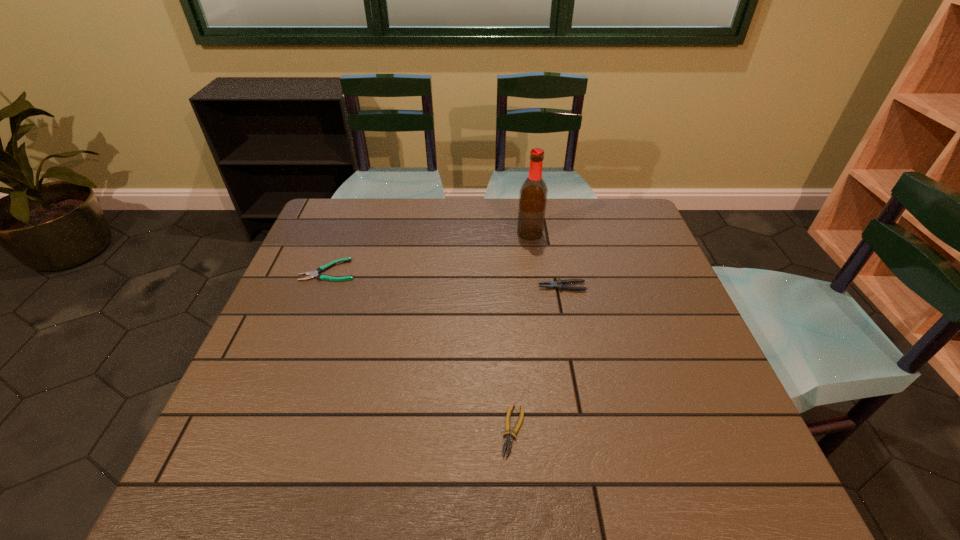
Where is `vacant area situated 0.050m at the gripping part of the tallest pliers`? Image resolution: width=960 pixels, height=540 pixels. vacant area situated 0.050m at the gripping part of the tallest pliers is located at coordinates (520, 287).

Identify the location of free point located 0.340m on the front of the leftmost object. The image size is (960, 540). (284, 387).

At what (x,y) coordinates should I click in order to perform the action: click on vacant space located on the right of the nearest pliers. Please return your answer as a coordinate pair (x, y). The width and height of the screenshot is (960, 540). Looking at the image, I should click on (580, 430).

This screenshot has height=540, width=960. Find the location of `object present at the far edge`. object present at the far edge is located at coordinates (533, 194).

At what (x,y) coordinates should I click in order to perform the action: click on object situated at the near edge. Please return your answer as a coordinate pair (x, y). Looking at the image, I should click on (508, 441).

Locate an element on the screen. This screenshot has width=960, height=540. object at the left edge is located at coordinates (312, 274).

Where is `free space at the far edge`? The height and width of the screenshot is (540, 960). free space at the far edge is located at coordinates (377, 239).

The width and height of the screenshot is (960, 540). Identify the location of blank area at the near edge. (410, 458).

What are the coordinates of `vacant area at the left edge` in the screenshot? It's located at (303, 392).

In order to click on vacant space at the right edge of the desktop in this screenshot , I will do `click(649, 247)`.